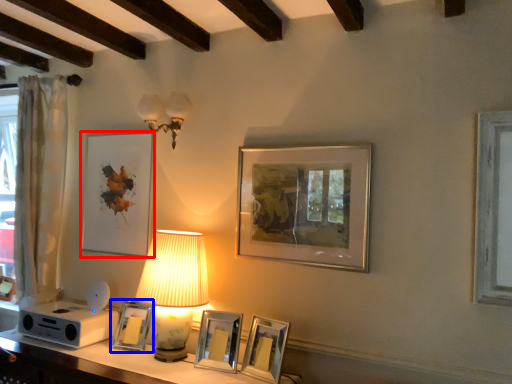
Question: Which object is further to the camera taking this photo, picture frame (highlighted by a red box) or picture frame (highlighted by a blue box)?

Choices:
 (A) picture frame
 (B) picture frame

Answer: (A)